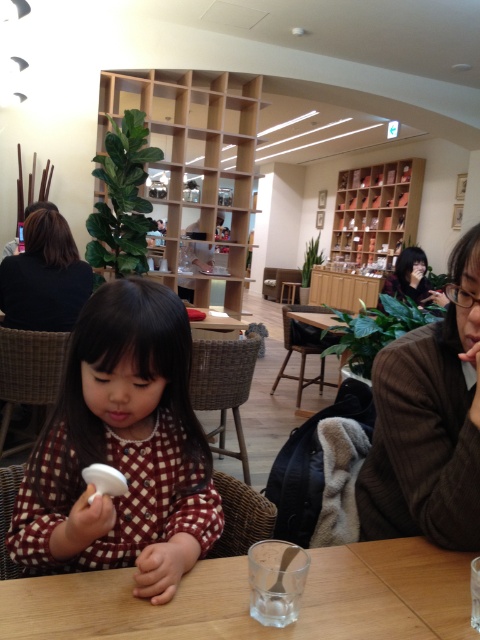
Question: Is white matte spoon at center positioned before brown textured jacket at right?

Choices:
 (A) no
 (B) yes

Answer: (B)

Question: Can you confirm if brown textured jacket at right is positioned to the left of dark brown hair at upper left?

Choices:
 (A) no
 (B) yes

Answer: (A)

Question: Which of these objects is positioned closest to the brown textured jacket at right?

Choices:
 (A) dark brown hair at upper left
 (B) white matte spoon at center
 (C) wooden table at center
 (D) matte black hair at upper right

Answer: (C)

Question: Based on their relative distances, which object is nearer to the matte black hair at upper right?

Choices:
 (A) brown textured jacket at right
 (B) white matte spoon at center
 (C) dark brown hair at upper left

Answer: (C)

Question: Which object is closer to the camera taking this photo?

Choices:
 (A) white matte spoon at center
 (B) brown textured jacket at right

Answer: (A)

Question: Can you confirm if wooden table at center is wider than brown textured jacket at right?

Choices:
 (A) yes
 (B) no

Answer: (A)